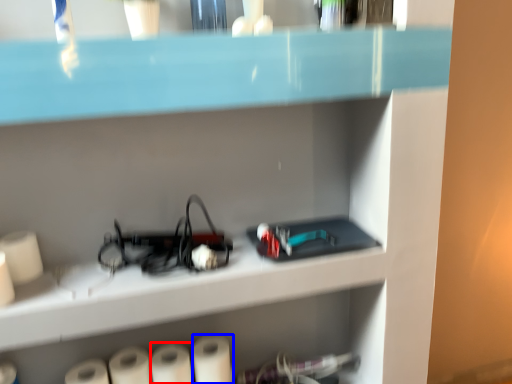
Question: Which object appears farthest to the camera in this image, paper towel (highlighted by a red box) or paper towel (highlighted by a blue box)?

Choices:
 (A) paper towel
 (B) paper towel

Answer: (B)